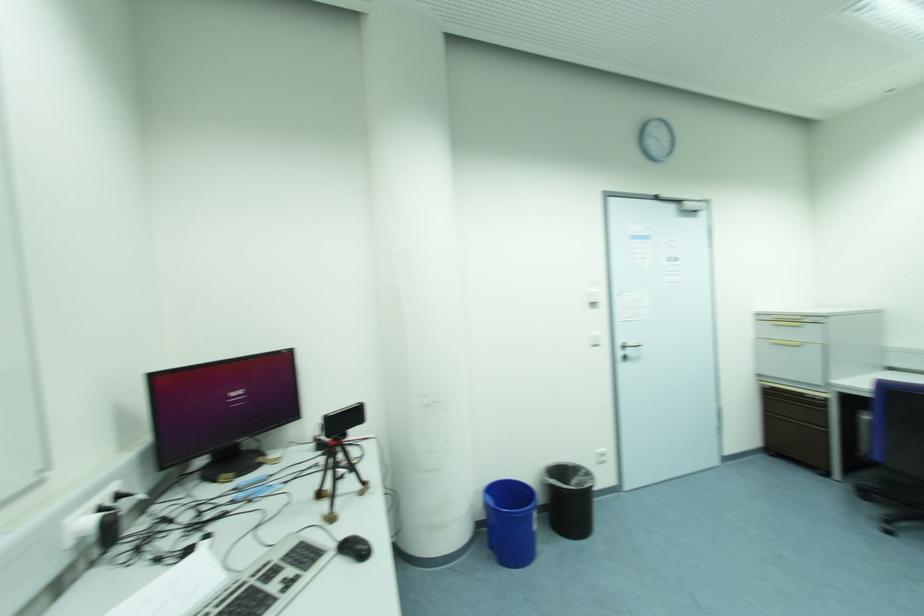
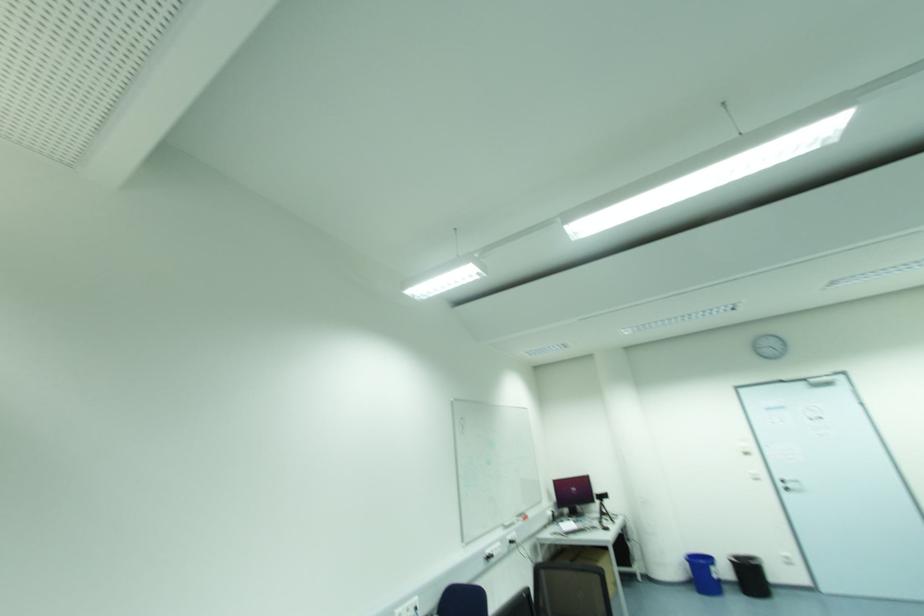
In the second image, find the point that corresponds to the point at 630,353 in the first image.

(789, 485)